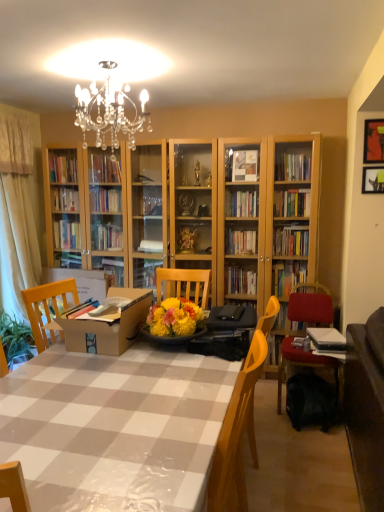
Question: Could you tell me if black fabric backpack at lower right is turned towards metallic silver picture frame at upper right, which ranks as the 1th picture frame in bottom-to-top order?

Choices:
 (A) yes
 (B) no

Answer: (B)

Question: Does black fabric backpack at lower right have a lesser width compared to metallic silver picture frame at upper right, placed as the second picture frame when sorted from top to bottom?

Choices:
 (A) no
 (B) yes

Answer: (A)

Question: From a real-world perspective, does black fabric backpack at lower right stand above metallic silver picture frame at upper right, placed as the second picture frame when sorted from top to bottom?

Choices:
 (A) no
 (B) yes

Answer: (A)

Question: Is black fabric backpack at lower right closer to the viewer compared to metallic silver picture frame at upper right, which ranks as the 1th picture frame in bottom-to-top order?

Choices:
 (A) yes
 (B) no

Answer: (A)

Question: Can metallic silver picture frame at upper right, placed as the second picture frame when sorted from top to bottom, be found inside black fabric backpack at lower right?

Choices:
 (A) yes
 (B) no

Answer: (B)

Question: From a real-world perspective, is black fabric backpack at lower right physically located above or below metallic silver picture frame at upper right, placed as the second picture frame when sorted from top to bottom?

Choices:
 (A) below
 (B) above

Answer: (A)

Question: Considering the positions of black fabric backpack at lower right and metallic silver picture frame at upper right, placed as the second picture frame when sorted from top to bottom, in the image, is black fabric backpack at lower right wider or thinner than metallic silver picture frame at upper right, placed as the second picture frame when sorted from top to bottom,?

Choices:
 (A) thin
 (B) wide

Answer: (B)

Question: Considering the positions of point (326, 409) and point (382, 180), is point (326, 409) closer or farther from the camera than point (382, 180)?

Choices:
 (A) closer
 (B) farther

Answer: (B)

Question: From the image's perspective, relative to metallic silver picture frame at upper right, which ranks as the 1th picture frame in bottom-to-top order, is black fabric backpack at lower right above or below?

Choices:
 (A) above
 (B) below

Answer: (B)

Question: Relative to black fabric backpack at lower right, is velvet red chair at right in front or behind?

Choices:
 (A) front
 (B) behind

Answer: (B)

Question: Considering the positions of velvet red chair at right and black fabric backpack at lower right in the image, is velvet red chair at right taller or shorter than black fabric backpack at lower right?

Choices:
 (A) tall
 (B) short

Answer: (A)

Question: In the image, is velvet red chair at right on the left side or the right side of black fabric backpack at lower right?

Choices:
 (A) left
 (B) right

Answer: (B)

Question: In terms of size, does velvet red chair at right appear bigger or smaller than black fabric backpack at lower right?

Choices:
 (A) small
 (B) big

Answer: (B)

Question: Which is correct: brown cardboard box at center is inside metallic gold picture frame at upper right, the 1th picture frame viewed from the top, or outside of it?

Choices:
 (A) inside
 (B) outside

Answer: (B)

Question: Considering their positions, is brown cardboard box at center located in front of or behind metallic gold picture frame at upper right, which is counted as the second picture frame, starting from the bottom?

Choices:
 (A) front
 (B) behind

Answer: (A)